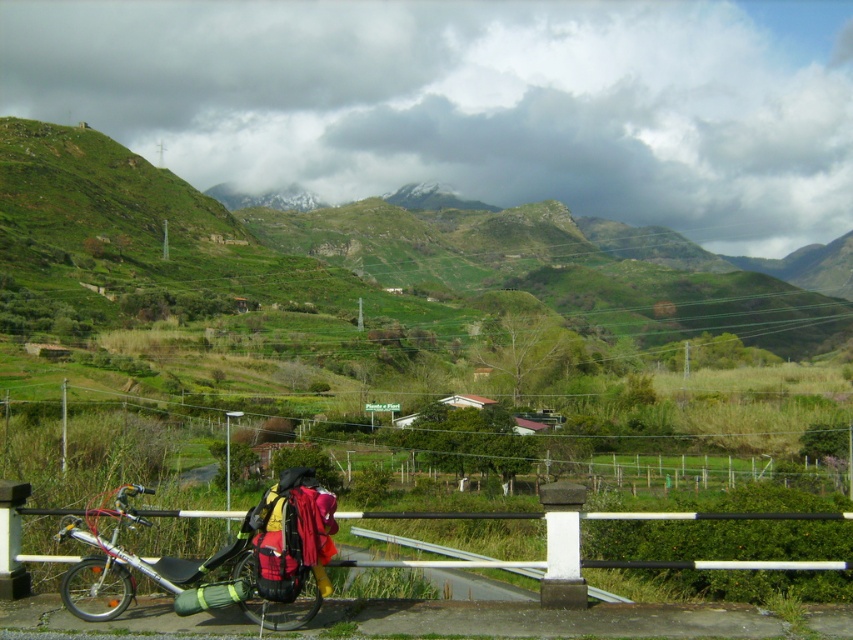
Question: Which point is closer to the camera?

Choices:
 (A) (270, 577)
 (B) (71, 509)

Answer: (A)

Question: Can you confirm if metallic silver bicycle at lower left is positioned below white metal rail at lower left?

Choices:
 (A) yes
 (B) no

Answer: (B)

Question: Among these objects, which one is nearest to the camera?

Choices:
 (A) metallic silver bicycle at lower left
 (B) white metal rail at lower left

Answer: (A)

Question: Which of the following is the closest to the observer?

Choices:
 (A) metallic silver bicycle at lower left
 (B) white metal rail at lower left

Answer: (A)

Question: Is metallic silver bicycle at lower left thinner than white metal rail at lower left?

Choices:
 (A) no
 (B) yes

Answer: (B)

Question: Can you confirm if metallic silver bicycle at lower left is positioned to the right of white metal rail at lower left?

Choices:
 (A) yes
 (B) no

Answer: (B)